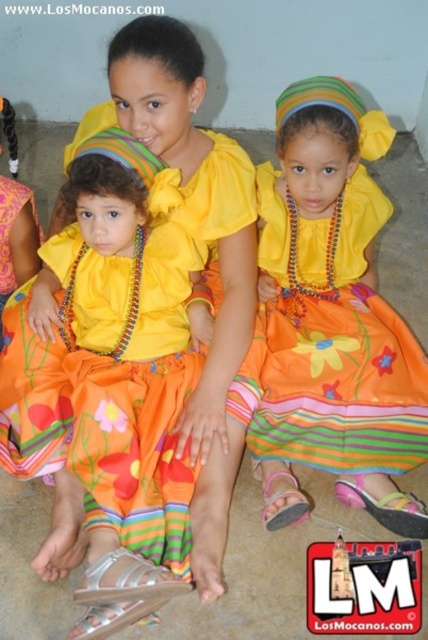
How distant is matte yellow blouse at center from matte orange dress at center?

They are 40.63 centimeters apart.

Describe the element at coordinates (112, 372) in the screenshot. I see `matte yellow blouse at center` at that location.

Does point (70, 314) come closer to viewer compared to point (335, 252)?

That is True.

I want to click on matte yellow blouse at center, so click(112, 372).